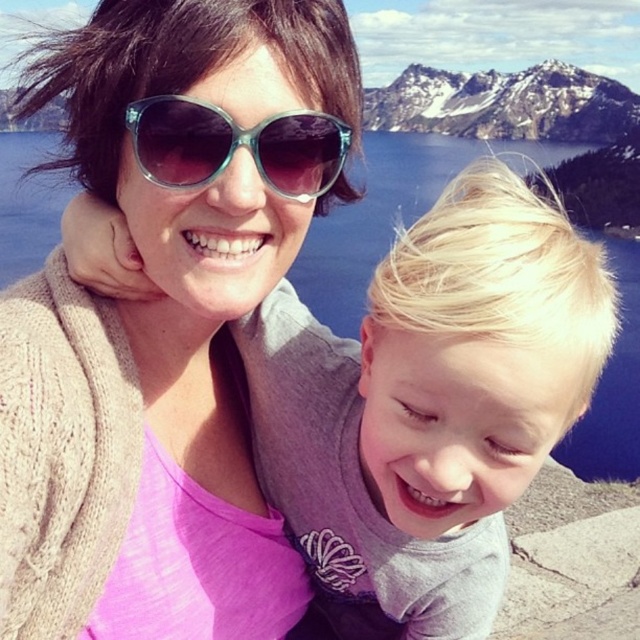
Question: Estimate the real-world distances between objects in this image. Which object is farther from the snowy granite mountain at upper center?

Choices:
 (A) matte black sunglasses at upper center
 (B) translucent teal sunglasses at center
 (C) blue glassy water at center
 (D) blonde hair at center

Answer: (B)

Question: Can you confirm if matte black sunglasses at upper center is smaller than snowy granite mountain at upper center?

Choices:
 (A) yes
 (B) no

Answer: (A)

Question: Does blue glassy water at center lie in front of snowy granite mountain at upper center?

Choices:
 (A) yes
 (B) no

Answer: (A)

Question: Among these points, which one is farthest from the camera?

Choices:
 (A) (392, 422)
 (B) (147, 131)

Answer: (A)

Question: Observing the image, what is the correct spatial positioning of blue glassy water at center in reference to snowy granite mountain at upper center?

Choices:
 (A) left
 (B) right

Answer: (A)

Question: Which of the following is the closest to the observer?

Choices:
 (A) translucent teal sunglasses at center
 (B) blue glassy water at center

Answer: (A)